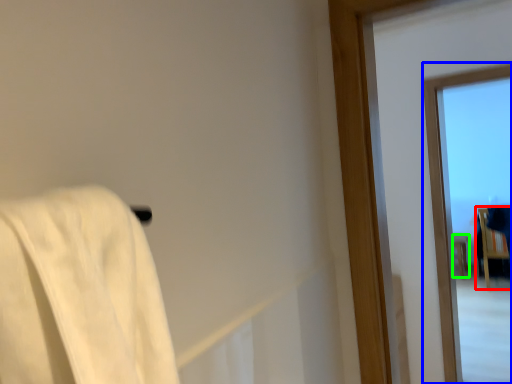
Question: Considering the real-world distances, which object is closest to furniture (highlighted by a red box)? window (highlighted by a blue box) or furniture (highlighted by a green box).

Choices:
 (A) window
 (B) furniture

Answer: (B)